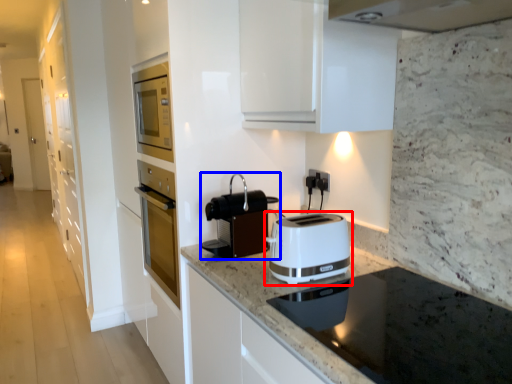
Question: Which point is further to the camera, toaster (highlighted by a red box) or kitchen appliance (highlighted by a blue box)?

Choices:
 (A) toaster
 (B) kitchen appliance

Answer: (B)